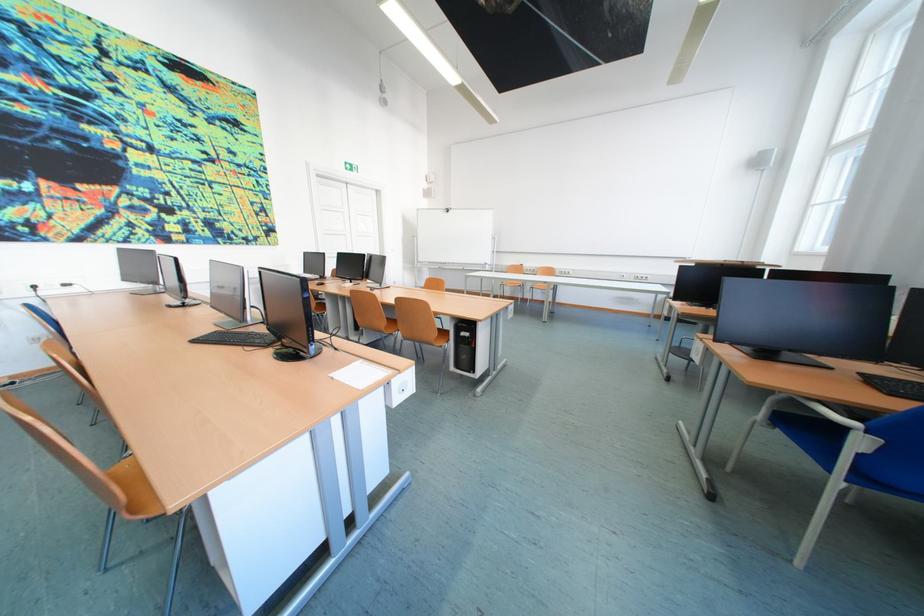
Describe the element at coordinates (236, 338) in the screenshot. I see `the black computer keyboard` at that location.